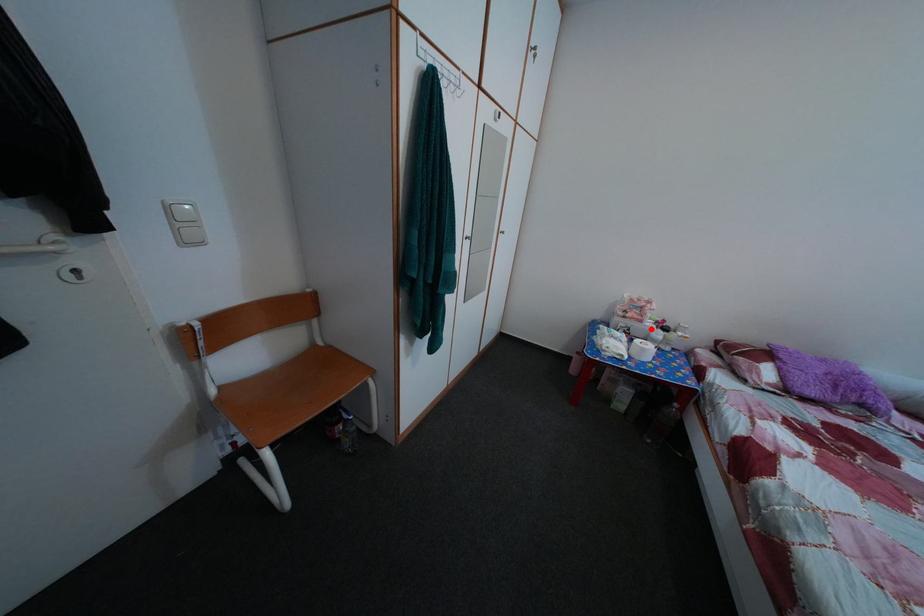
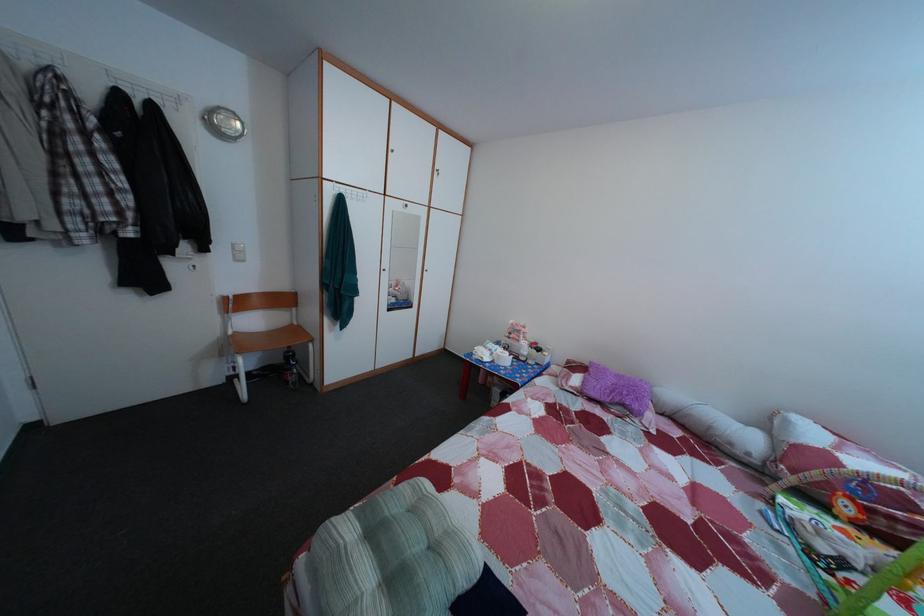
Where in the second image is the point corresponding to the highlighted location from the first image?

(528, 349)